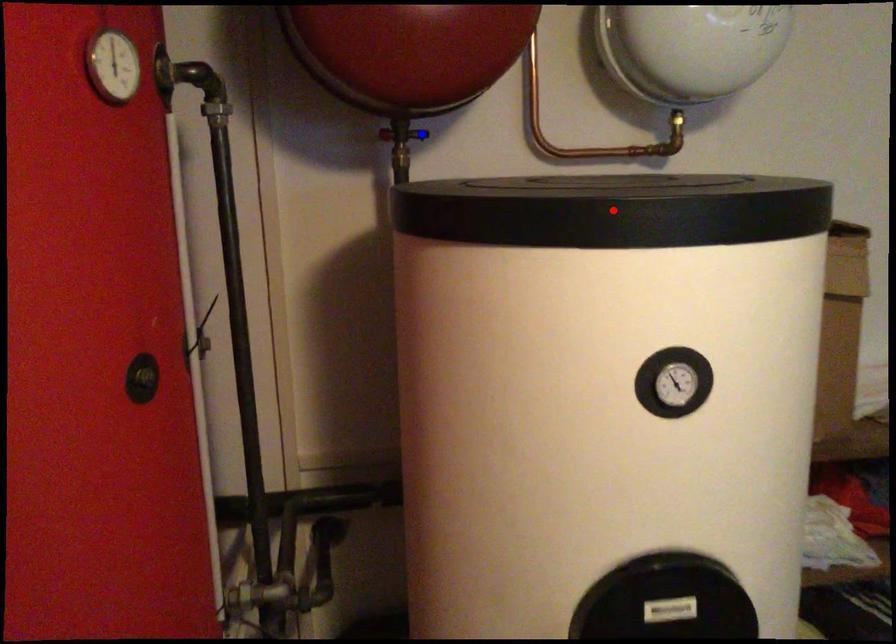
Question: Which of the two points in the image is closer to the camera?

Choices:
 (A) Blue point is closer.
 (B) Red point is closer.

Answer: (B)